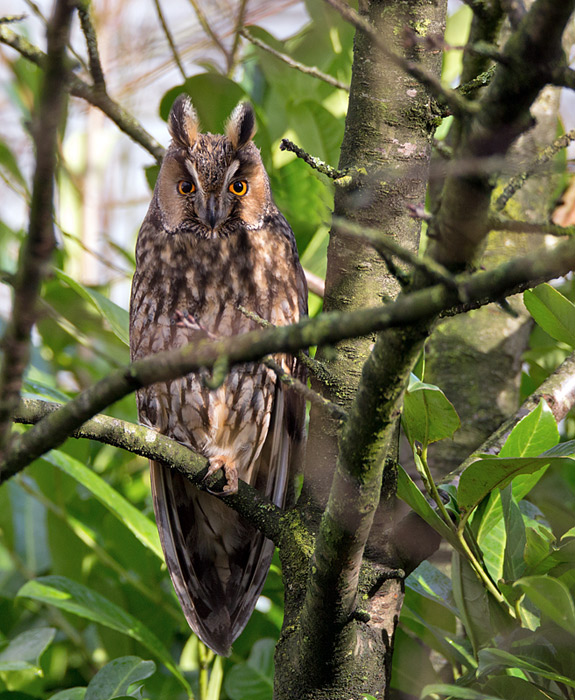
Image resolution: width=575 pixels, height=700 pixels. I want to click on the chest, so click(221, 270).